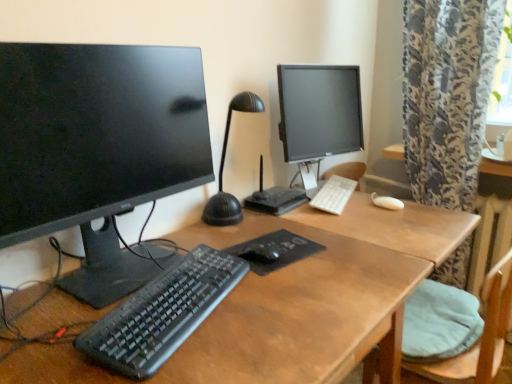
Where is `vacant space situated above wooden desk at center (from a real-world perspective)`? vacant space situated above wooden desk at center (from a real-world perspective) is located at coordinates (258, 270).